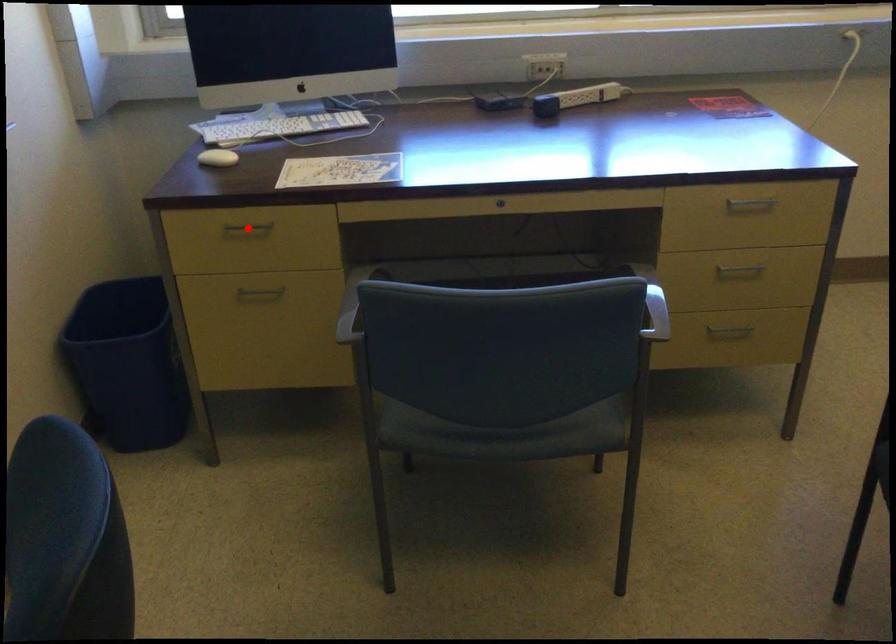
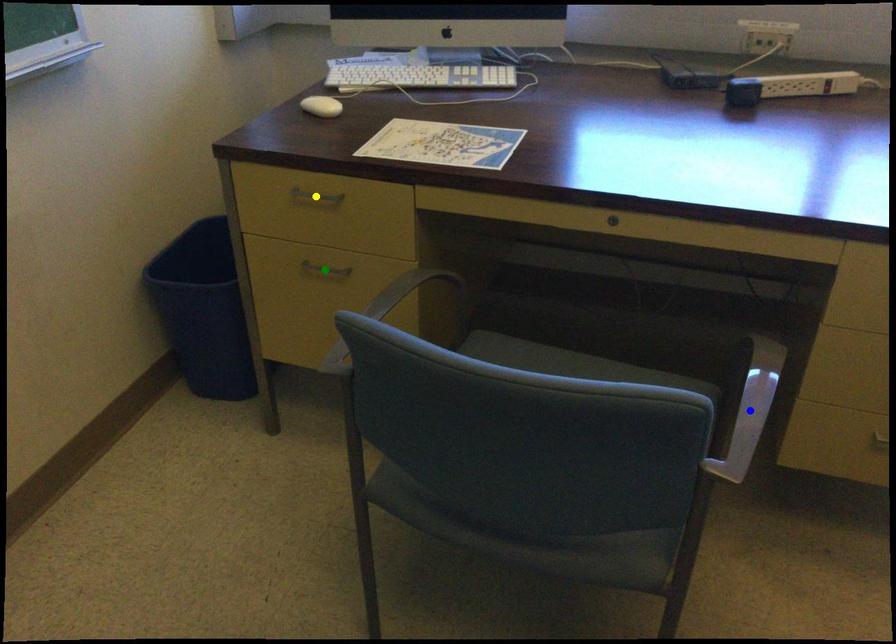
Question: I am providing you with two images of the same scene from different viewpoints. A red point is marked on the first image. You are given multiple points on the second image. Which mark in image 2 goes with the point in image 1?

Choices:
 (A) yellow point
 (B) blue point
 (C) green point

Answer: (A)